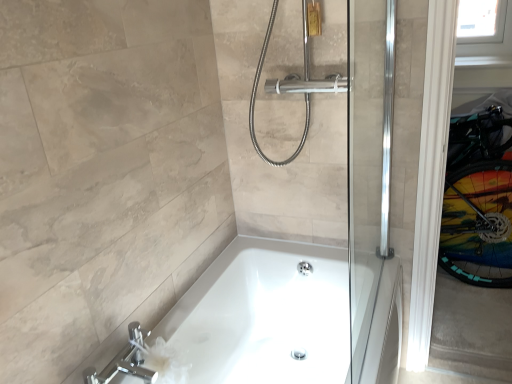
Question: Considering the relative sizes of transparent plastic window screen at upper right and white glossy bathtub at center in the image provided, is transparent plastic window screen at upper right wider than white glossy bathtub at center?

Choices:
 (A) yes
 (B) no

Answer: (B)

Question: Considering the relative positions of transparent plastic window screen at upper right and white glossy bathtub at center in the image provided, is transparent plastic window screen at upper right in front of white glossy bathtub at center?

Choices:
 (A) yes
 (B) no

Answer: (B)

Question: Can you confirm if transparent plastic window screen at upper right is positioned to the right of white glossy bathtub at center?

Choices:
 (A) yes
 (B) no

Answer: (A)

Question: Is transparent plastic window screen at upper right shorter than white glossy bathtub at center?

Choices:
 (A) no
 (B) yes

Answer: (B)

Question: Does transparent plastic window screen at upper right have a smaller size compared to white glossy bathtub at center?

Choices:
 (A) yes
 (B) no

Answer: (A)

Question: Is chrome/metallic faucet at lower left in front of or behind transparent plastic window screen at upper right in the image?

Choices:
 (A) front
 (B) behind

Answer: (A)

Question: Would you say chrome/metallic faucet at lower left is to the left or to the right of transparent plastic window screen at upper right in the picture?

Choices:
 (A) right
 (B) left

Answer: (B)

Question: Which is correct: chrome/metallic faucet at lower left is inside transparent plastic window screen at upper right, or outside of it?

Choices:
 (A) inside
 (B) outside

Answer: (B)

Question: From a real-world perspective, is chrome/metallic faucet at lower left above or below transparent plastic window screen at upper right?

Choices:
 (A) below
 (B) above

Answer: (A)

Question: From a real-world perspective, relative to chrome/metallic faucet at lower left, is transparent plastic window screen at upper right vertically above or below?

Choices:
 (A) above
 (B) below

Answer: (A)

Question: In terms of height, does transparent plastic window screen at upper right look taller or shorter compared to chrome/metallic faucet at lower left?

Choices:
 (A) tall
 (B) short

Answer: (A)

Question: Is transparent plastic window screen at upper right wider or thinner than chrome/metallic faucet at lower left?

Choices:
 (A) thin
 (B) wide

Answer: (A)

Question: Is transparent plastic window screen at upper right spatially inside chrome/metallic faucet at lower left, or outside of it?

Choices:
 (A) outside
 (B) inside

Answer: (A)

Question: Do you think chrome/metallic faucet at lower left is within white glossy bathtub at center, or outside of it?

Choices:
 (A) inside
 (B) outside

Answer: (B)

Question: In terms of width, does chrome/metallic faucet at lower left look wider or thinner when compared to white glossy bathtub at center?

Choices:
 (A) thin
 (B) wide

Answer: (A)